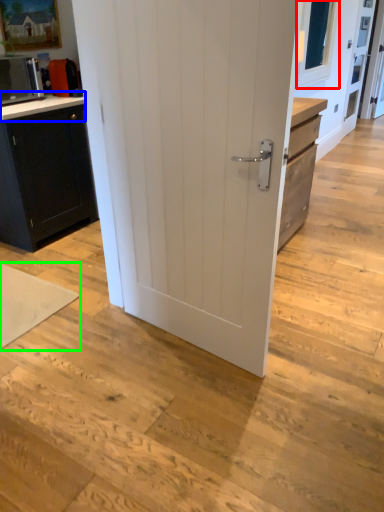
Question: Which is farther away from window screen (highlighted by a red box)? counter top (highlighted by a blue box) or yoga mat (highlighted by a green box)?

Choices:
 (A) counter top
 (B) yoga mat

Answer: (B)